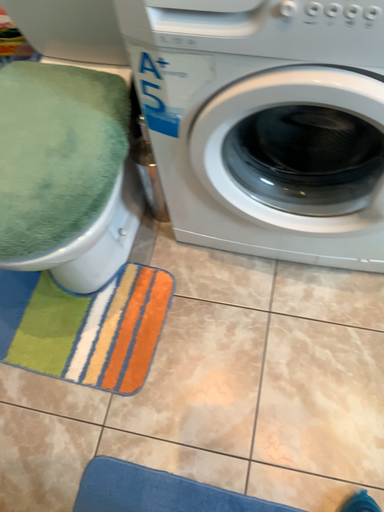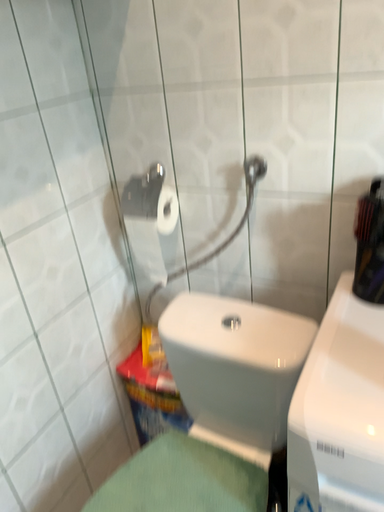
Question: Which way did the camera rotate in the video?

Choices:
 (A) rotated downward
 (B) rotated upward

Answer: (B)